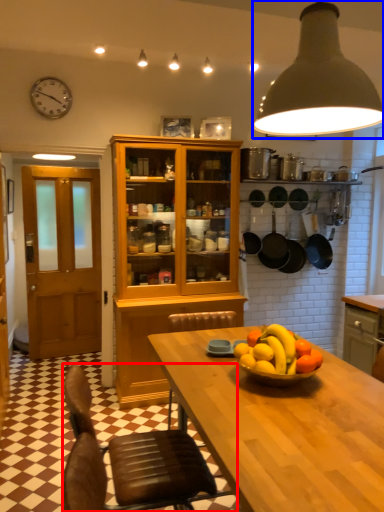
Question: Which of the following is the farthest to the observer, chair (highlighted by a red box) or light (highlighted by a blue box)?

Choices:
 (A) chair
 (B) light

Answer: (A)